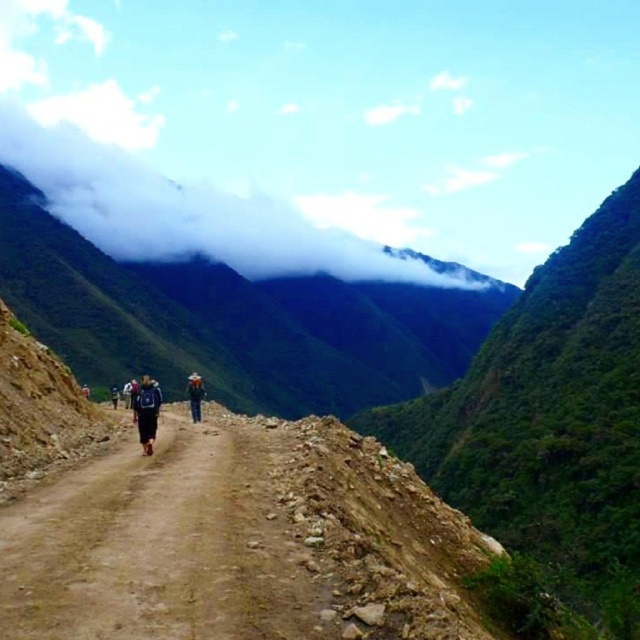
You are a hiker standing on the dirt path and looking at the white fluffy cloud at upper center and the black backpack at center. Which object is closer to you?

The black backpack at center is closer to you because the white fluffy cloud at upper center is further away.

You are a hiker standing at the starting point of the trail and looking towards the mountains. Which object, the brown dirt track at center or the white fluffy cloud at upper center, is positioned to the right when viewed from your perspective?

The brown dirt track at center is positioned to the right of the white fluffy cloud at upper center, so the brown dirt track at center is to the right when viewed from your perspective.